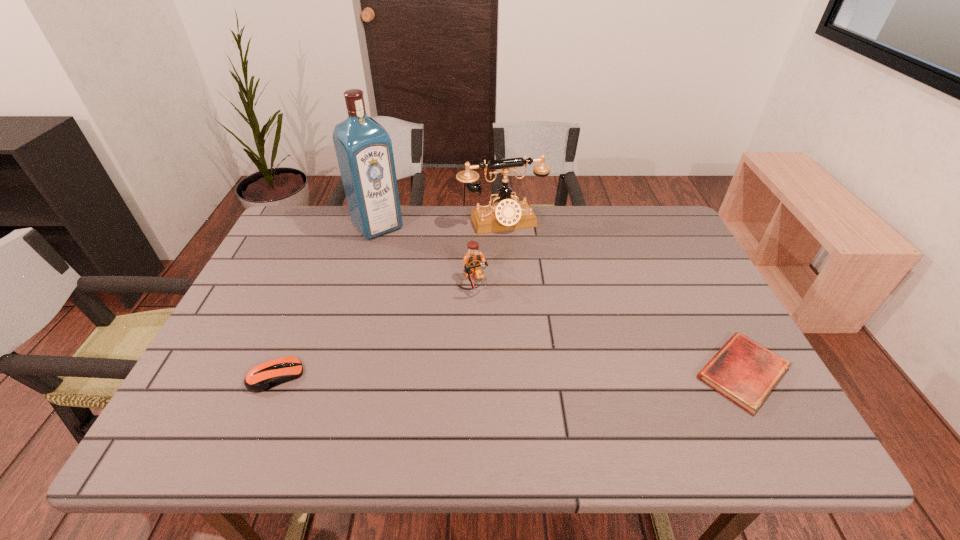
Where is `computer mouse that is positioned at the near edge`? computer mouse that is positioned at the near edge is located at coordinates (266, 375).

Where is `diary that is at the near edge`? This screenshot has width=960, height=540. diary that is at the near edge is located at coordinates (743, 371).

The height and width of the screenshot is (540, 960). What are the coordinates of `object situated at the left edge` in the screenshot? It's located at (266, 375).

At what (x,y) coordinates should I click in order to perform the action: click on object located in the right edge section of the desktop. Please return your answer as a coordinate pair (x, y). This screenshot has height=540, width=960. Looking at the image, I should click on (743, 371).

The image size is (960, 540). In order to click on object present at the near left corner in this screenshot , I will do `click(266, 375)`.

Locate an element on the screen. This screenshot has width=960, height=540. object present at the near right corner is located at coordinates (743, 371).

Locate an element on the screen. The height and width of the screenshot is (540, 960). vacant space at the far edge is located at coordinates (454, 214).

At what (x,y) coordinates should I click in order to perform the action: click on free region at the near edge of the desktop. Please return your answer as a coordinate pair (x, y). This screenshot has width=960, height=540. Looking at the image, I should click on (634, 383).

The image size is (960, 540). Find the location of `vacant region at the left edge of the desktop`. vacant region at the left edge of the desktop is located at coordinates tap(290, 300).

This screenshot has width=960, height=540. I want to click on vacant space at the right edge of the desktop, so click(680, 332).